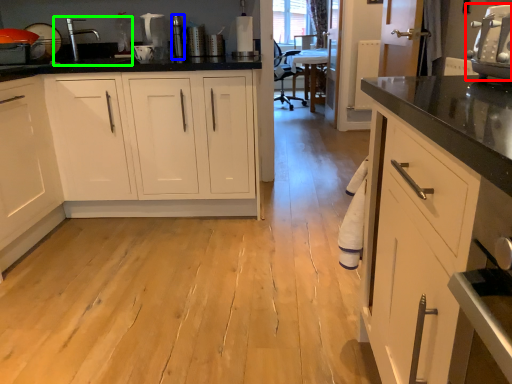
Question: Which object is positioned closest to home appliance (highlighted by a red box)? Select from appliance (highlighted by a blue box) and sink (highlighted by a green box).

Choices:
 (A) appliance
 (B) sink

Answer: (A)